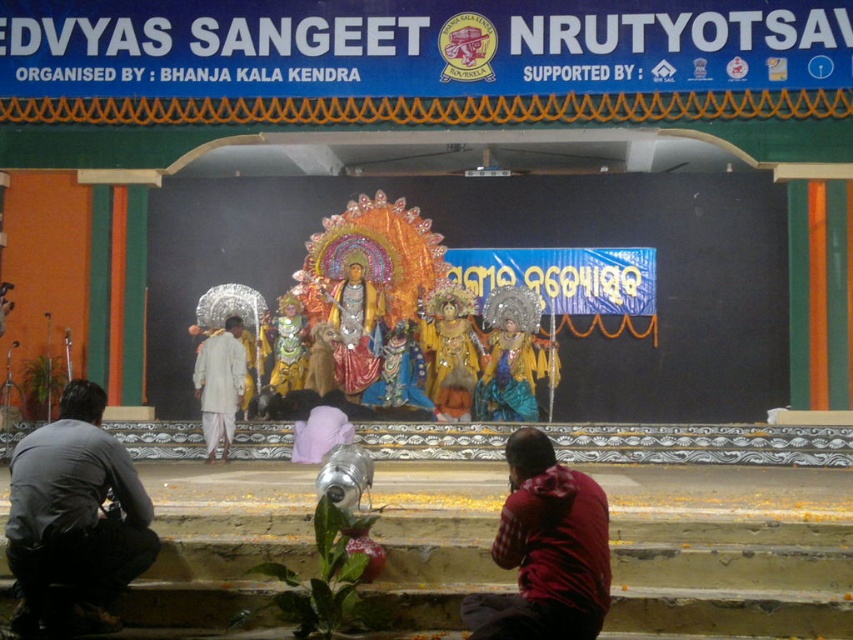
Question: Which point is farther to the camera?

Choices:
 (A) (589, 604)
 (B) (343, 369)

Answer: (B)

Question: Based on their relative distances, which object is farther from the gold metallic statue at center?

Choices:
 (A) gold sequined costume at center
 (B) white cotton kurta at center

Answer: (A)

Question: Is gold metallic costume at center positioned in front of gold metallic statue at center?

Choices:
 (A) no
 (B) yes

Answer: (B)

Question: Can you confirm if gold metallic costume at center is positioned above white cotton kurta at center?

Choices:
 (A) yes
 (B) no

Answer: (A)

Question: Is gold metallic costume at center to the left of gold metallic statue at center from the viewer's perspective?

Choices:
 (A) yes
 (B) no

Answer: (B)

Question: Which point is farther to the camera?

Choices:
 (A) gold metallic statue at center
 (B) red plaid shirt at lower right

Answer: (A)